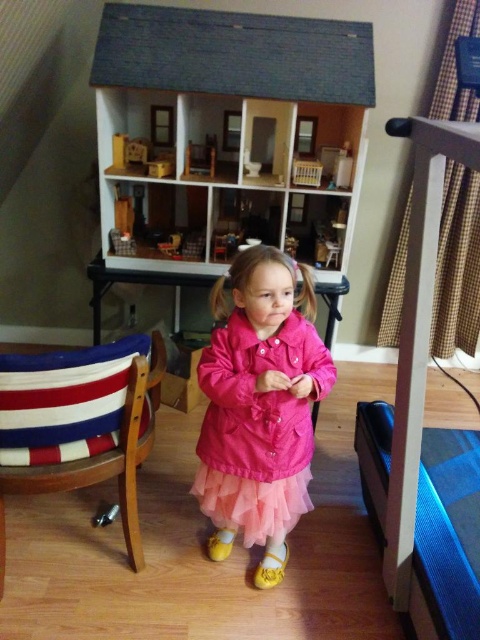
Question: In this image, where is pink matte coat at center located relative to striped fabric chair at lower left?

Choices:
 (A) left
 (B) right

Answer: (B)

Question: Which of the following is the farthest from the observer?

Choices:
 (A) (260, 408)
 (B) (448, 577)
 (C) (283, 500)
 (D) (130, 545)

Answer: (D)

Question: Which of these objects is positioned closest to the blue fabric bunk bed at right?

Choices:
 (A) pink matte coat at center
 (B) striped fabric chair at lower left

Answer: (A)

Question: Is pink matte coat at center below striped fabric chair at lower left?

Choices:
 (A) no
 (B) yes

Answer: (A)

Question: Considering the real-world distances, which object is farthest from the striped fabric chair at lower left?

Choices:
 (A) pink matte coat at center
 (B) blue fabric bunk bed at right

Answer: (B)

Question: Can you confirm if pink matte coat at center is bigger than blue fabric bunk bed at right?

Choices:
 (A) yes
 (B) no

Answer: (B)